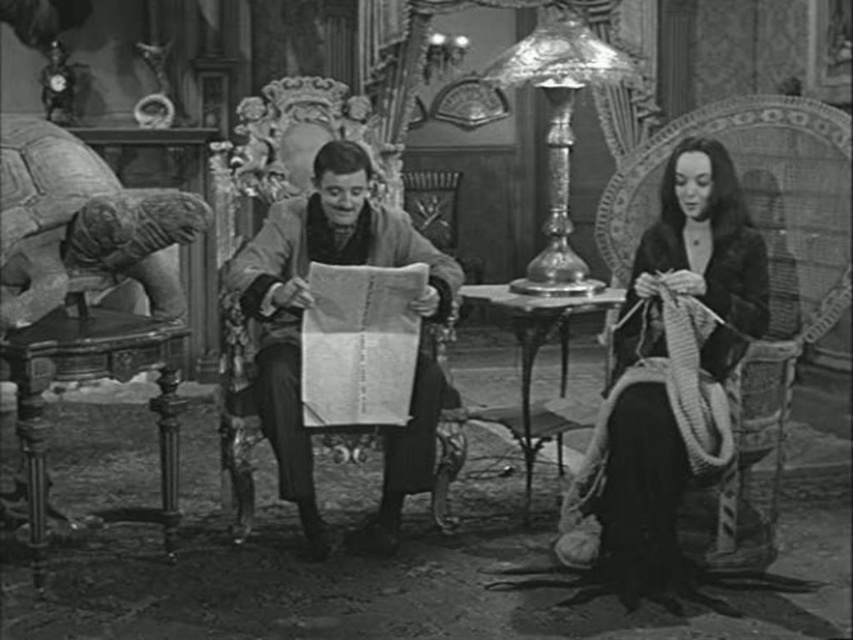
Question: Which point is closer to the camera?

Choices:
 (A) (403, 449)
 (B) (605, 474)
 (C) (553, 96)

Answer: (B)

Question: Which point is farther to the camera?

Choices:
 (A) shiny glass lamp at center
 (B) velvet black dress at right
 (C) smooth brown coat at center

Answer: (A)

Question: Where is velvet black dress at right located in relation to smooth brown coat at center in the image?

Choices:
 (A) left
 (B) right

Answer: (B)

Question: Does velvet black dress at right appear on the right side of smooth brown coat at center?

Choices:
 (A) yes
 (B) no

Answer: (A)

Question: Can you confirm if velvet black dress at right is smaller than smooth brown coat at center?

Choices:
 (A) yes
 (B) no

Answer: (A)

Question: Which of these objects is positioned closest to the velvet black dress at right?

Choices:
 (A) smooth brown coat at center
 (B) shiny glass lamp at center

Answer: (B)